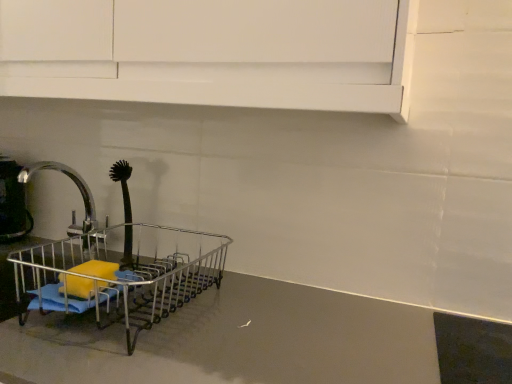
This screenshot has width=512, height=384. What do you see at coordinates (80, 193) in the screenshot? I see `silver metallic faucet at left` at bounding box center [80, 193].

Find the location of a particular element. This screenshot has width=512, height=384. black rubber brush at left is located at coordinates (123, 185).

Considering their positions, is metallic silver dish rack at left located in front of or behind silver metallic faucet at left?

metallic silver dish rack at left is positioned closer to the viewer than silver metallic faucet at left.

Between metallic silver dish rack at left and silver metallic faucet at left, which one has larger size?

With larger size is metallic silver dish rack at left.

Does metallic silver dish rack at left have a lesser width compared to silver metallic faucet at left?

No, metallic silver dish rack at left is not thinner than silver metallic faucet at left.

From the image's perspective, is metallic silver dish rack at left above silver metallic faucet at left?

No, from the image's perspective, metallic silver dish rack at left is not on top of silver metallic faucet at left.

Is metallic gray counter top at center facing towards silver metallic faucet at left?

No, metallic gray counter top at center is not oriented towards silver metallic faucet at left.

Does metallic gray counter top at center have a greater height compared to silver metallic faucet at left?

Indeed, metallic gray counter top at center has a greater height compared to silver metallic faucet at left.

Is metallic gray counter top at center closer to camera compared to silver metallic faucet at left?

Yes, it is.

Does metallic gray counter top at center have a larger size compared to silver metallic faucet at left?

Correct, metallic gray counter top at center is larger in size than silver metallic faucet at left.

In the scene shown: Is black rubber brush at left with metallic gray counter top at center?

There is a gap between black rubber brush at left and metallic gray counter top at center.

From the image's perspective, relative to metallic gray counter top at center, is black rubber brush at left above or below?

From the image's perspective, black rubber brush at left appears above metallic gray counter top at center.

Based on their sizes in the image, would you say black rubber brush at left is bigger or smaller than metallic gray counter top at center?

Considering their sizes, black rubber brush at left takes up less space than metallic gray counter top at center.

Can you confirm if silver metallic faucet at left is taller than metallic gray counter top at center?

No.

Which point is more forward, (77,232) or (417,367)?

Positioned in front is point (417,367).

In terms of width, does silver metallic faucet at left look wider or thinner when compared to metallic gray counter top at center?

Clearly, silver metallic faucet at left has less width compared to metallic gray counter top at center.

Is silver metallic faucet at left closer to the viewer compared to metallic gray counter top at center?

No, it is not.

From a real-world perspective, between silver metallic faucet at left and black rubber brush at left, who is vertically higher?

In real-world perspective, black rubber brush at left is above.

Is silver metallic faucet at left to the right of black rubber brush at left from the viewer's perspective?

No, silver metallic faucet at left is not to the right of black rubber brush at left.

Considering the sizes of silver metallic faucet at left and black rubber brush at left in the image, is silver metallic faucet at left wider or thinner than black rubber brush at left?

Considering their sizes, silver metallic faucet at left looks broader than black rubber brush at left.

Is silver metallic faucet at left next to black rubber brush at left and touching it?

No, silver metallic faucet at left is not in contact with black rubber brush at left.

Could you tell me if metallic silver kettle at left is facing metallic gray counter top at center?

No, metallic silver kettle at left is not oriented towards metallic gray counter top at center.

From the image's perspective, does metallic silver kettle at left appear lower than metallic gray counter top at center?

Incorrect, from the image's perspective, metallic silver kettle at left is higher than metallic gray counter top at center.

Based on the photo, which of these two, metallic silver kettle at left or metallic gray counter top at center, stands shorter?

metallic silver kettle at left is shorter.

Does metallic silver kettle at left have a lesser width compared to metallic gray counter top at center?

Yes.

Looking at this image, from a real-world perspective, relative to metallic silver kettle at left, is metallic silver dish rack at left vertically above or below?

metallic silver dish rack at left is below metallic silver kettle at left.

Relative to metallic silver kettle at left, is metallic silver dish rack at left in front or behind?

Visually, metallic silver dish rack at left is located in front of metallic silver kettle at left.

Considering the points (174, 249) and (27, 210), which point is behind, point (174, 249) or point (27, 210)?

The point (27, 210) is more distant.

Is metallic silver dish rack at left far away from metallic silver kettle at left?

No, metallic silver dish rack at left is not far away from metallic silver kettle at left.

Find the location of a particular element. This screenshot has height=384, width=512. tap above the metallic silver dish rack at left (from the image's perspective) is located at coordinates (80, 193).

This screenshot has height=384, width=512. I want to click on counter top in front of the silver metallic faucet at left, so click(x=236, y=341).

Looking at the image, which one is located further to metallic silver kettle at left, black rubber brush at left or metallic silver dish rack at left?

metallic silver dish rack at left is positioned further to the anchor metallic silver kettle at left.

Considering their positions, is metallic silver dish rack at left positioned closer to metallic silver kettle at left than silver metallic faucet at left?

Based on the image, silver metallic faucet at left appears to be nearer to metallic silver kettle at left.

Looking at the image, which one is located closer to silver metallic faucet at left, metallic gray counter top at center or black rubber brush at left?

Among the two, black rubber brush at left is located nearer to silver metallic faucet at left.

From the image, which object appears to be farther from black rubber brush at left, metallic silver dish rack at left or metallic gray counter top at center?

metallic gray counter top at center is positioned further to the anchor black rubber brush at left.

Which object lies nearer to the anchor point black rubber brush at left, metallic gray counter top at center or silver metallic faucet at left?

silver metallic faucet at left is closer to black rubber brush at left.

From the image, which object appears to be farther from metallic gray counter top at center, black rubber brush at left or metallic silver dish rack at left?

black rubber brush at left is positioned further to the anchor metallic gray counter top at center.

When comparing their distances from silver metallic faucet at left, does metallic silver kettle at left or metallic silver dish rack at left seem further?

The object further to silver metallic faucet at left is metallic silver dish rack at left.

In the scene shown: When comparing their distances from metallic silver kettle at left, does metallic gray counter top at center or black rubber brush at left seem closer?

black rubber brush at left is positioned closer to the anchor metallic silver kettle at left.

Image resolution: width=512 pixels, height=384 pixels. In order to click on tap situated between metallic silver kettle at left and black rubber brush at left from left to right in this screenshot , I will do `click(80, 193)`.

Identify the location of shopping cart between metallic gray counter top at center and silver metallic faucet at left in the front-back direction. (119, 275).

Locate an element on the screen. tap between metallic gray counter top at center and metallic silver kettle at left in the front-back direction is located at coordinates (80, 193).

At what (x,y) coordinates should I click in order to perform the action: click on brush located between metallic silver kettle at left and metallic silver dish rack at left in the left-right direction. Please return your answer as a coordinate pair (x, y). The image size is (512, 384). Looking at the image, I should click on (123, 185).